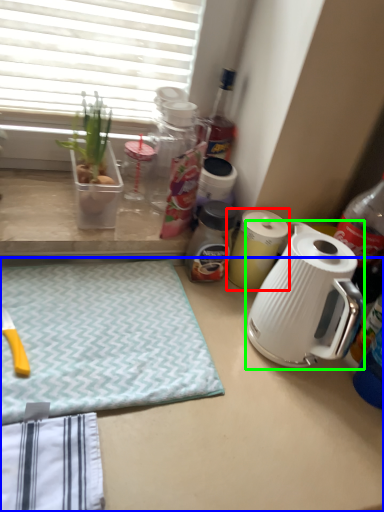
Question: Based on their relative distances, which object is farther from kitchen appliance (highlighted by a red box)? Choose from desk (highlighted by a blue box) and kettle (highlighted by a green box).

Choices:
 (A) desk
 (B) kettle

Answer: (A)